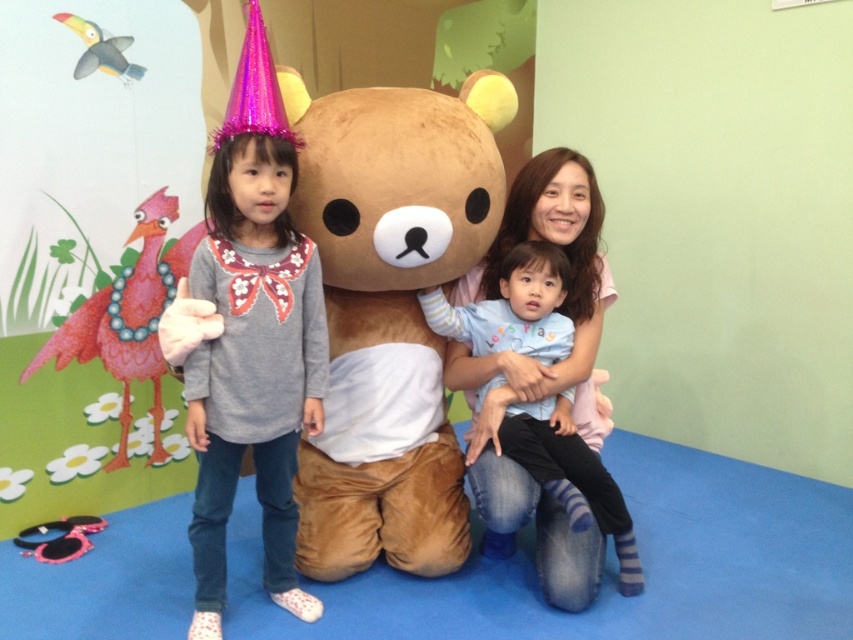
You are a photographer trying to capture a group photo of the scene. You need to ensure that the brown plush bear at center and the light blue cotton shirt at center are both in focus. Given that your camera has a depth of field that can cover 14 inches, will both subjects be in focus?

The distance between the brown plush bear at center and the light blue cotton shirt at center is 13.83 inches, which is within the camera depth of field of 14 inches. Therefore, both subjects will be in focus.

You are a photographer trying to capture a clear photo of both the brown plush bear at center and the matte gray sweater at center. Which object should you focus on first to ensure it appears sharp in the photo?

The brown plush bear at center is closer to the viewer than the matte gray sweater at center, so you should focus on the brown plush bear at center first to ensure it appears sharp. Since the sweater is farther away, adjusting focus might be needed for it to be clear as well.